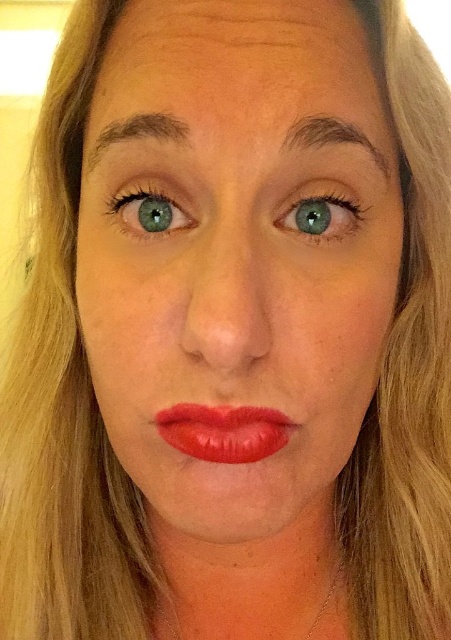
You are a makeup artist preparing for a photoshoot. You need to apply eyeliner to both the green matte eye at center and the green matte eye at upper center. Given that the distance between them is 5.51 centimeters, will you need to adjust your application technique to ensure symmetry?

The green matte eye at center and green matte eye at upper center are 5.51 centimeters apart from each other. Since eyeliner application typically requires precise placement relative to the eye shape rather than fixed distances between eyes, the distance itself doesn not necessitate a technique adjustment for symmetry. Focus on aligning each eyeliner symmetrically within their respective eye shapes.

You are an artist trying to draw this person. You want to make sure the green matte eye at center and the green matte eye at upper center look three dimensional. Which one should you shade more to create depth?

The green matte eye at center is closer to the viewer, so you should shade it more to create the illusion of depth compared to the green matte eye at upper center which is further away.